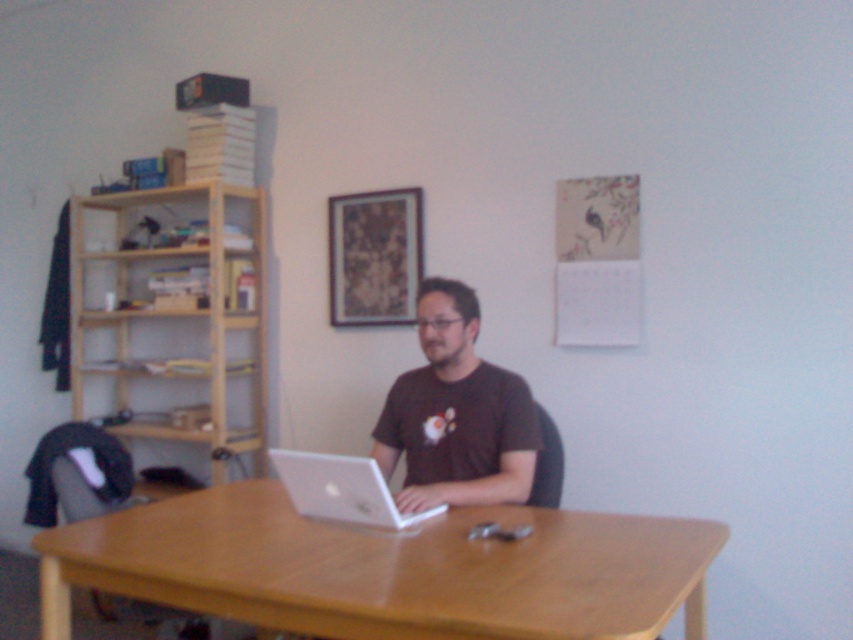
Between light wood bookshelf at left and silver metallic laptop at center, which one is positioned higher?

Positioned higher is light wood bookshelf at left.

Is light wood bookshelf at left taller than silver metallic laptop at center?

Yes, light wood bookshelf at left is taller than silver metallic laptop at center.

Where is `light wood bookshelf at left`? light wood bookshelf at left is located at coordinates (173, 323).

Does point (421, 410) come closer to viewer compared to point (321, 516)?

That is False.

Is brown cotton shirt at center above silver metallic laptop at center?

Correct, brown cotton shirt at center is located above silver metallic laptop at center.

Describe the element at coordinates (456, 413) in the screenshot. I see `brown cotton shirt at center` at that location.

Locate an element on the screen. The width and height of the screenshot is (853, 640). brown cotton shirt at center is located at coordinates tap(456, 413).

Can you confirm if light brown wood table at center is positioned to the right of light wood bookshelf at left?

Yes, light brown wood table at center is to the right of light wood bookshelf at left.

Does point (289, 621) lie in front of point (233, 192)?

Yes, point (289, 621) is in front of point (233, 192).

This screenshot has width=853, height=640. Describe the element at coordinates (386, 570) in the screenshot. I see `light brown wood table at center` at that location.

Where is `light brown wood table at center`? The width and height of the screenshot is (853, 640). light brown wood table at center is located at coordinates (386, 570).